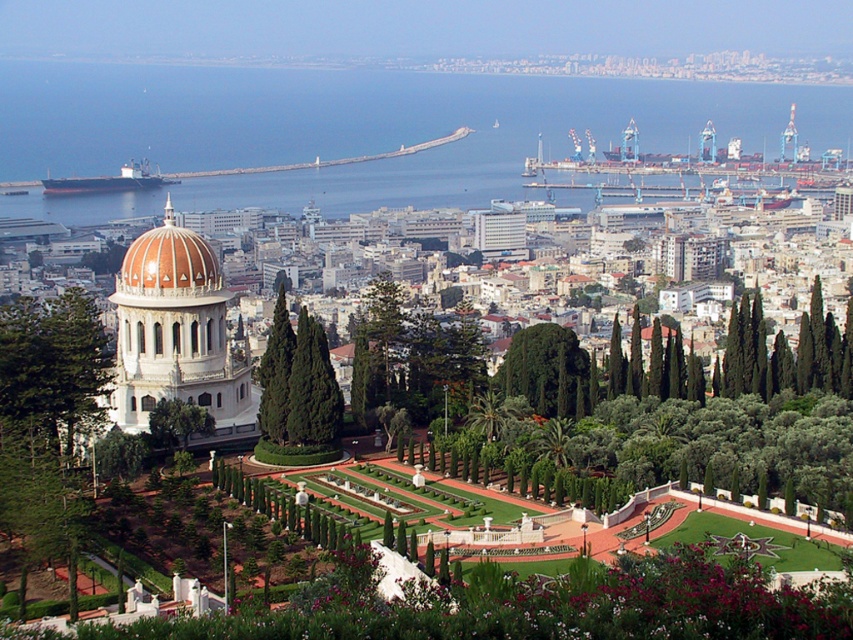
In order to click on green textured tree at center in this screenshot , I will do `click(299, 384)`.

Does green textured tree at center have a larger size compared to green leafy tree at center?

Actually, green textured tree at center might be smaller than green leafy tree at center.

The height and width of the screenshot is (640, 853). I want to click on green textured tree at center, so click(x=299, y=384).

Does white marble dome at left have a greater width compared to green leafy tree at center-left?

Yes.

Between white marble dome at left and green leafy tree at center-left, which one appears on the left side from the viewer's perspective?

green leafy tree at center-left

Who is more forward, (207, 380) or (7, 378)?

Point (7, 378) is more forward.

Locate an element on the screen. This screenshot has width=853, height=640. white marble dome at left is located at coordinates (177, 336).

Can you confirm if blue water at center is positioned to the left of green leafy tree at center?

Correct, you'll find blue water at center to the left of green leafy tree at center.

The width and height of the screenshot is (853, 640). Identify the location of blue water at center. (369, 125).

You are a GUI agent. You are given a task and a screenshot of the screen. Output one action in this format:
    pyautogui.click(x=<x>, y=<y>)
    Task: Click on the blue water at center
    This screenshot has width=853, height=640.
    Given the screenshot: What is the action you would take?
    pyautogui.click(x=369, y=125)